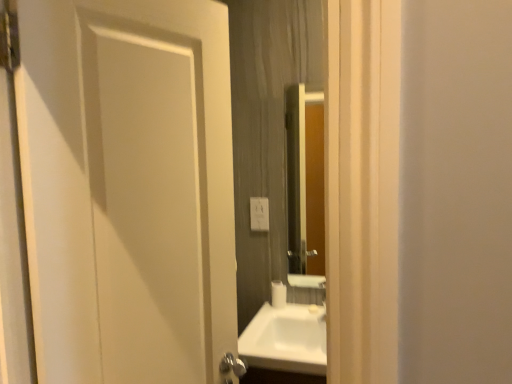
Question: Are smooth wooden mirror at center and white plastic electric outlet at center located far from each other?

Choices:
 (A) yes
 (B) no

Answer: (B)

Question: From the image's perspective, would you say smooth wooden mirror at center is positioned over white plastic electric outlet at center?

Choices:
 (A) no
 (B) yes

Answer: (B)

Question: From a real-world perspective, is smooth wooden mirror at center physically above white plastic electric outlet at center?

Choices:
 (A) yes
 (B) no

Answer: (A)

Question: Is smooth wooden mirror at center facing towards white plastic electric outlet at center?

Choices:
 (A) no
 (B) yes

Answer: (A)

Question: Does smooth wooden mirror at center come in front of white plastic electric outlet at center?

Choices:
 (A) no
 (B) yes

Answer: (B)

Question: Do you think white plastic electric outlet at center is within white glossy sink at center, or outside of it?

Choices:
 (A) outside
 (B) inside

Answer: (A)

Question: Does point (260, 221) appear closer or farther from the camera than point (294, 331)?

Choices:
 (A) closer
 (B) farther

Answer: (B)

Question: Based on their positions, is white plastic electric outlet at center located to the left or right of white glossy sink at center?

Choices:
 (A) right
 (B) left

Answer: (B)

Question: From a real-world perspective, relative to white glossy sink at center, is white plastic electric outlet at center vertically above or below?

Choices:
 (A) below
 (B) above

Answer: (B)

Question: Looking at the image, does white plastic electric outlet at center seem bigger or smaller compared to white matte toilet paper at center?

Choices:
 (A) big
 (B) small

Answer: (B)

Question: Is point (256, 205) positioned closer to the camera than point (276, 297)?

Choices:
 (A) closer
 (B) farther

Answer: (B)

Question: From the image's perspective, is white plastic electric outlet at center above or below white matte toilet paper at center?

Choices:
 (A) above
 (B) below

Answer: (A)

Question: Choose the correct answer: Is white plastic electric outlet at center inside white matte toilet paper at center or outside it?

Choices:
 (A) outside
 (B) inside

Answer: (A)

Question: From a real-world perspective, is white plastic electric outlet at center physically located above or below smooth wooden mirror at center?

Choices:
 (A) below
 (B) above

Answer: (A)

Question: From the image's perspective, relative to smooth wooden mirror at center, is white plastic electric outlet at center above or below?

Choices:
 (A) above
 (B) below

Answer: (B)